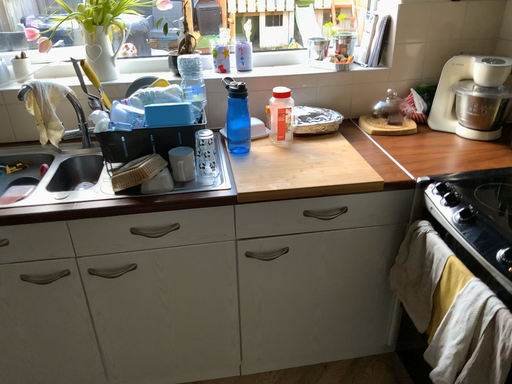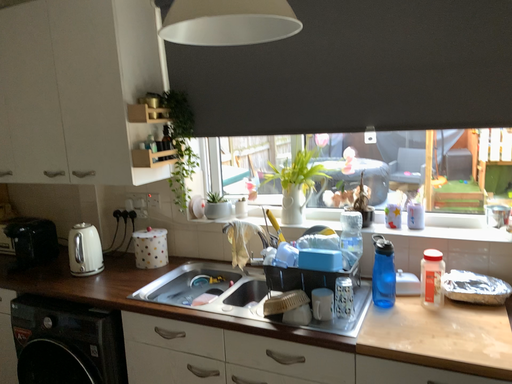
Question: How did the camera likely rotate when shooting the video?

Choices:
 (A) rotated right
 (B) rotated left

Answer: (B)